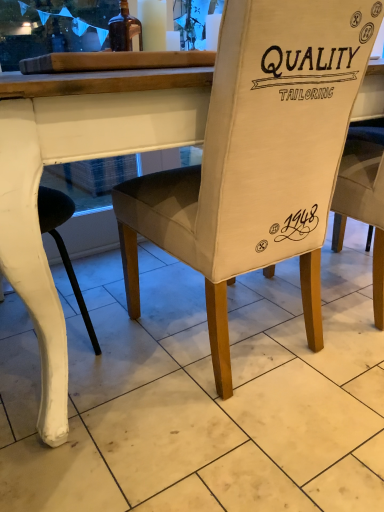
Locate an element on the screen. The height and width of the screenshot is (512, 384). vacant space in front of beige fabric chair at center is located at coordinates (223, 447).